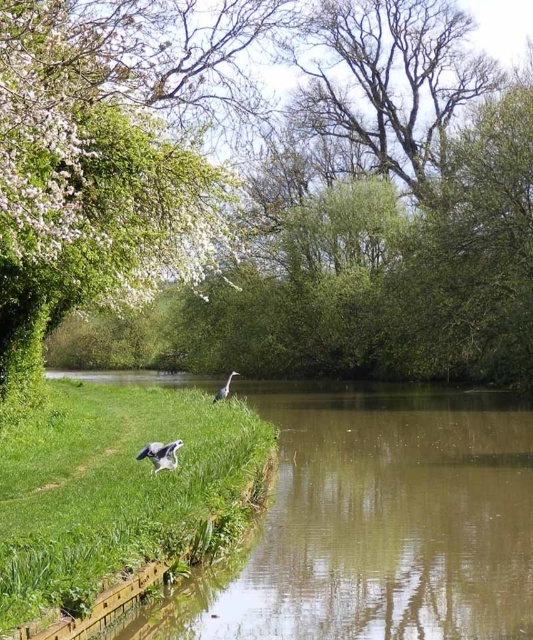
You are standing at the point marked as point (x=111, y=486) in the lower left of the image. Looking towards the water, what type of terrain do you see in front of you?

The point (x=111, y=486) is on green grass at lower left, so in front of you would be the water edge since the grass is adjacent to the water according to the scene description.